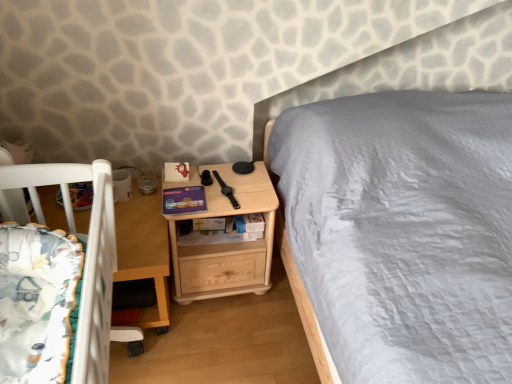
Question: Is light wood/texture nightstand at center situated inside fluffy white blanket at lower left or outside?

Choices:
 (A) inside
 (B) outside

Answer: (B)

Question: From their relative heights in the image, would you say light wood/texture nightstand at center is taller or shorter than fluffy white blanket at lower left?

Choices:
 (A) short
 (B) tall

Answer: (B)

Question: Which is nearer to the fluffy white blanket at lower left?

Choices:
 (A) light wood/texture nightstand at center
 (B) wooden table at lower left

Answer: (B)

Question: Which is farther from the fluffy white blanket at lower left?

Choices:
 (A) wooden table at lower left
 (B) light wood/texture nightstand at center

Answer: (B)